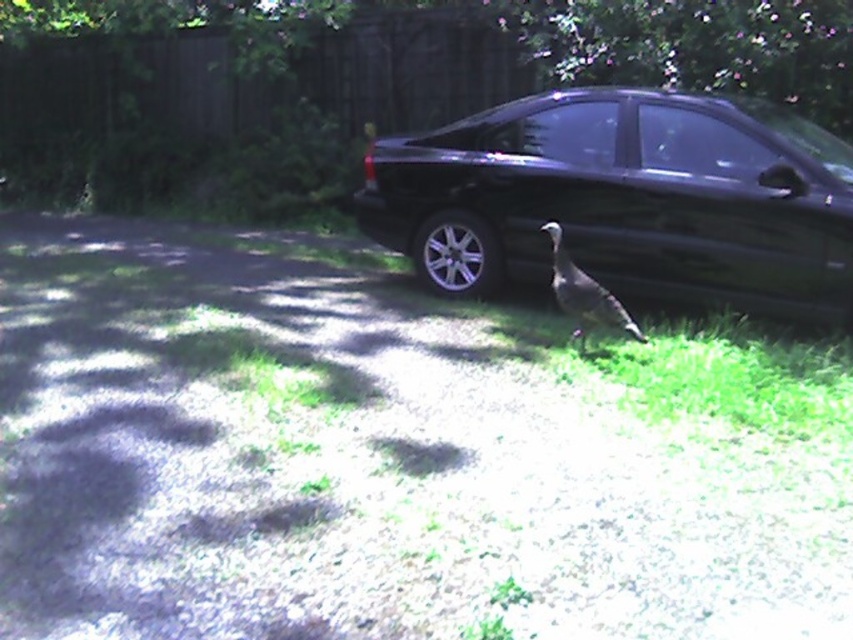
Question: Is black metallic car at center in front of gray feathered bird at center?

Choices:
 (A) yes
 (B) no

Answer: (B)

Question: Is black metallic car at center above gray feathered bird at center?

Choices:
 (A) yes
 (B) no

Answer: (A)

Question: Which point is farther from the camera taking this photo?

Choices:
 (A) (589, 310)
 (B) (403, 195)

Answer: (B)

Question: Which object is closer to the camera taking this photo?

Choices:
 (A) gray feathered bird at center
 (B) black metallic car at center

Answer: (A)

Question: Which of the following is the closest to the observer?

Choices:
 (A) (463, 202)
 (B) (601, 308)

Answer: (B)

Question: Does black metallic car at center have a larger size compared to gray feathered bird at center?

Choices:
 (A) yes
 (B) no

Answer: (A)